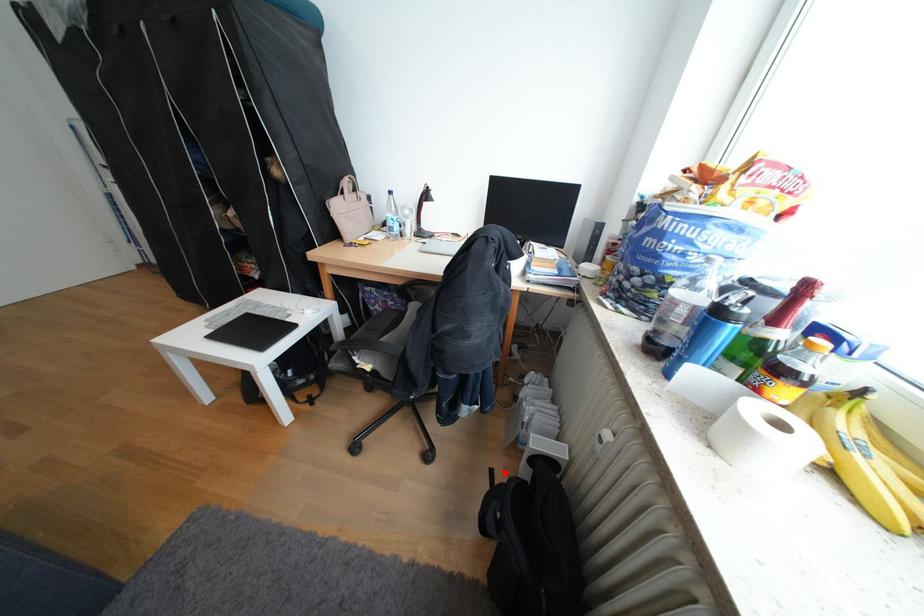
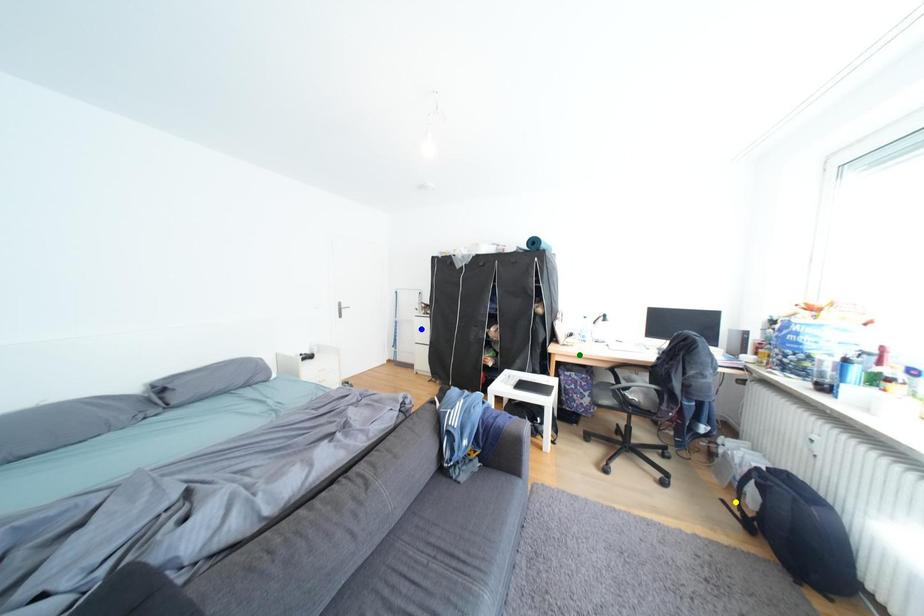
Question: I am providing you with two images of the same scene from different viewpoints. A red point is marked on the first image. You are given multiple points on the second image. Which point in image 2 is actually the same real-world point as the red point in image 1?

Choices:
 (A) yellow point
 (B) blue point
 (C) green point

Answer: (A)